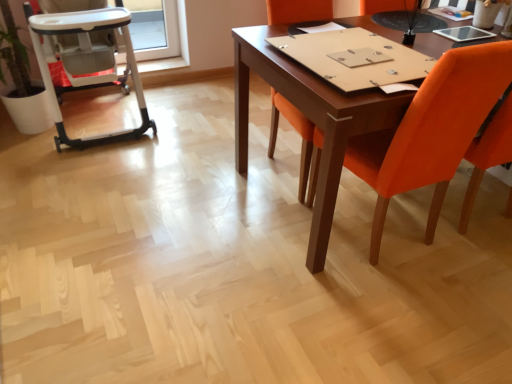
Question: Are orange fabric chair at center, the 2th chair when ordered from right to left, and orange fabric chair at right, the 2th chair when ordered from left to right, located far from each other?

Choices:
 (A) no
 (B) yes

Answer: (A)

Question: Is orange fabric chair at center, the 2th chair when ordered from right to left, not inside orange fabric chair at right, which ranks as the 1th chair in right-to-left order?

Choices:
 (A) no
 (B) yes

Answer: (B)

Question: Can you confirm if orange fabric chair at center, the 2th chair when ordered from right to left, is thinner than orange fabric chair at right, the 2th chair when ordered from left to right?

Choices:
 (A) no
 (B) yes

Answer: (B)

Question: Is orange fabric chair at center, acting as the first chair starting from the left, turned away from orange fabric chair at right, which ranks as the 1th chair in right-to-left order?

Choices:
 (A) yes
 (B) no

Answer: (B)

Question: Does orange fabric chair at center, acting as the first chair starting from the left, come in front of orange fabric chair at right, the 2th chair when ordered from left to right?

Choices:
 (A) yes
 (B) no

Answer: (B)

Question: From a real-world perspective, is orange fabric chair at center, the 2th chair when ordered from right to left, located beneath orange fabric chair at right, which ranks as the 1th chair in right-to-left order?

Choices:
 (A) no
 (B) yes

Answer: (A)

Question: From the image's perspective, is orange fabric chair at right, the 2th chair when ordered from left to right, on top of orange fabric chair at center, acting as the first chair starting from the left?

Choices:
 (A) no
 (B) yes

Answer: (A)

Question: Does orange fabric chair at right, which ranks as the 1th chair in right-to-left order, have a lesser width compared to orange fabric chair at center, acting as the first chair starting from the left?

Choices:
 (A) yes
 (B) no

Answer: (B)

Question: Is orange fabric chair at right, which ranks as the 1th chair in right-to-left order, positioned with its back to orange fabric chair at center, acting as the first chair starting from the left?

Choices:
 (A) yes
 (B) no

Answer: (B)

Question: Considering the relative sizes of orange fabric chair at right, which ranks as the 1th chair in right-to-left order, and orange fabric chair at center, acting as the first chair starting from the left, in the image provided, is orange fabric chair at right, which ranks as the 1th chair in right-to-left order, wider than orange fabric chair at center, acting as the first chair starting from the left,?

Choices:
 (A) no
 (B) yes

Answer: (B)

Question: Is orange fabric chair at right, the 2th chair when ordered from left to right, bigger than orange fabric chair at center, the 2th chair when ordered from right to left?

Choices:
 (A) no
 (B) yes

Answer: (A)

Question: Is orange fabric chair at right, the 2th chair when ordered from left to right, completely or partially outside of orange fabric chair at center, acting as the first chair starting from the left?

Choices:
 (A) no
 (B) yes

Answer: (B)

Question: Is white plastic high chair at left placed right next to orange fabric chair at right, the 2th chair when ordered from left to right?

Choices:
 (A) no
 (B) yes

Answer: (A)